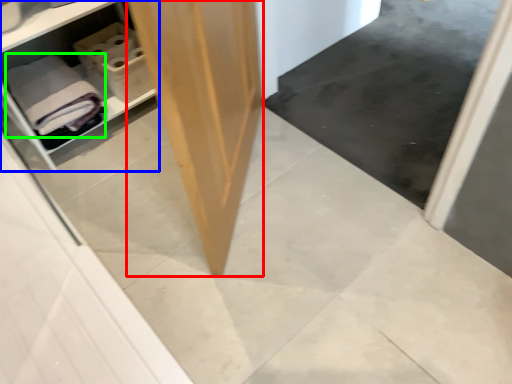
Question: Which is nearer to the plywood (highlighted by a red box)? shelf (highlighted by a blue box) or bath towel (highlighted by a green box).

Choices:
 (A) shelf
 (B) bath towel

Answer: (B)